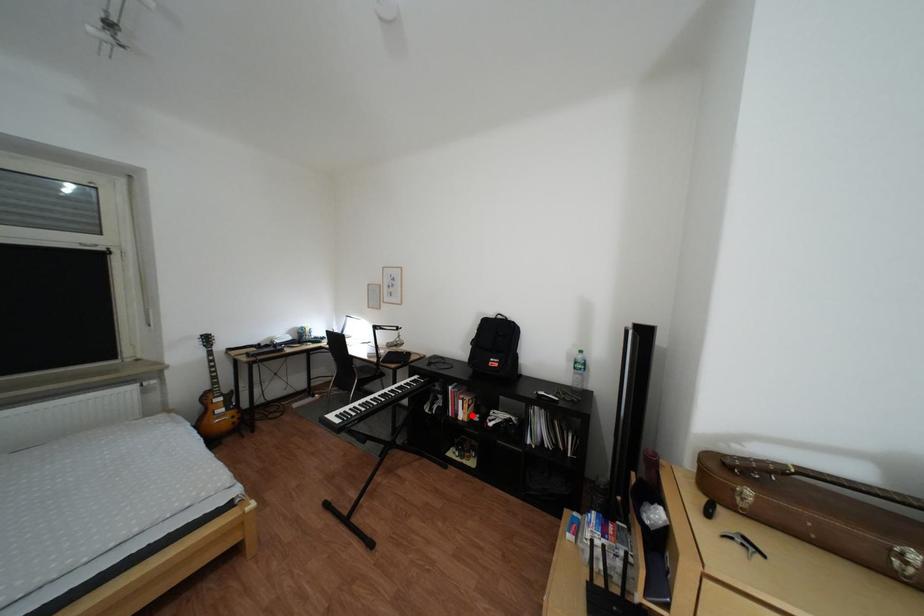
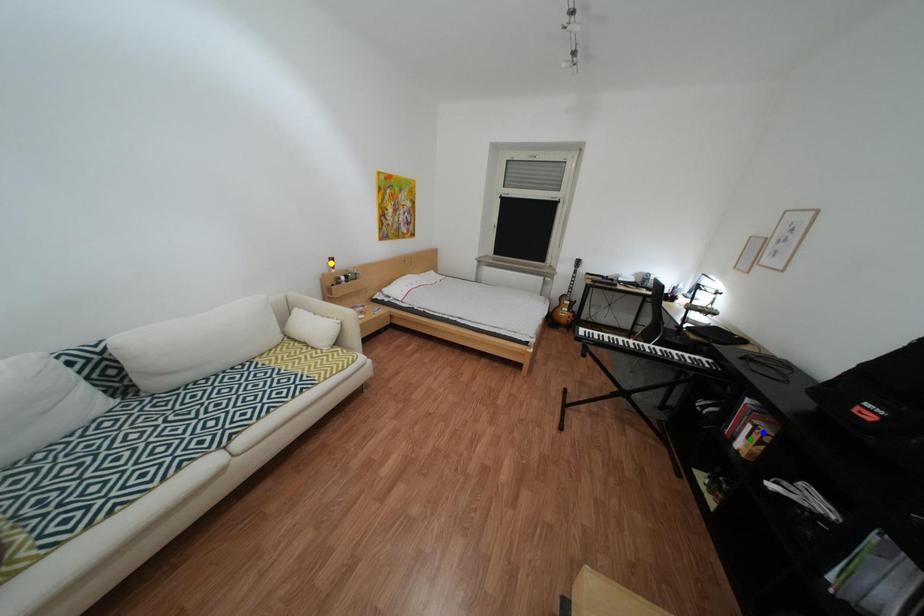
Question: I am providing you with two images of the same scene from different viewpoints. A red point is marked on the first image. You are given multiple points on the second image. In image 2, which mark is for the same physical point as the one in image 1?

Choices:
 (A) blue point
 (B) green point
 (C) yellow point

Answer: (B)